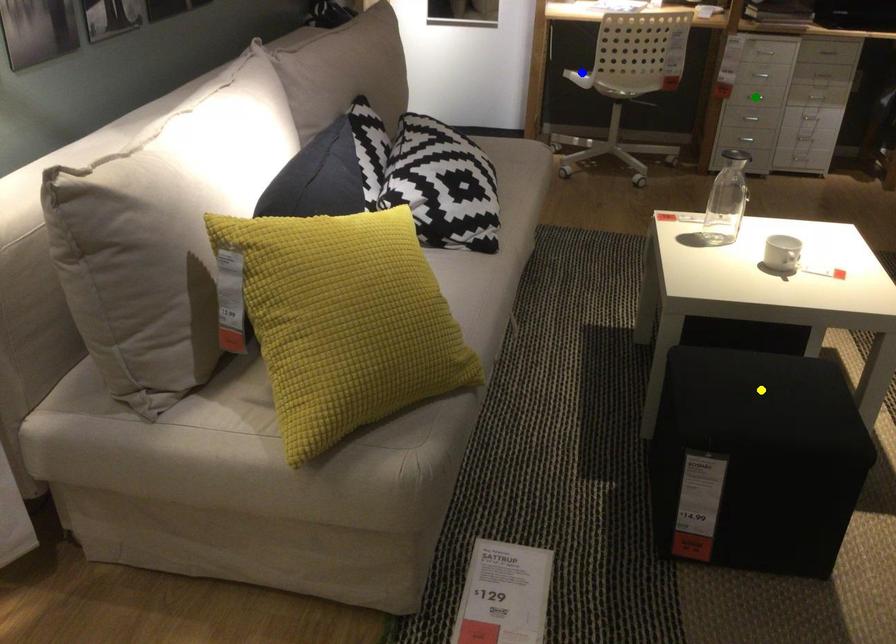
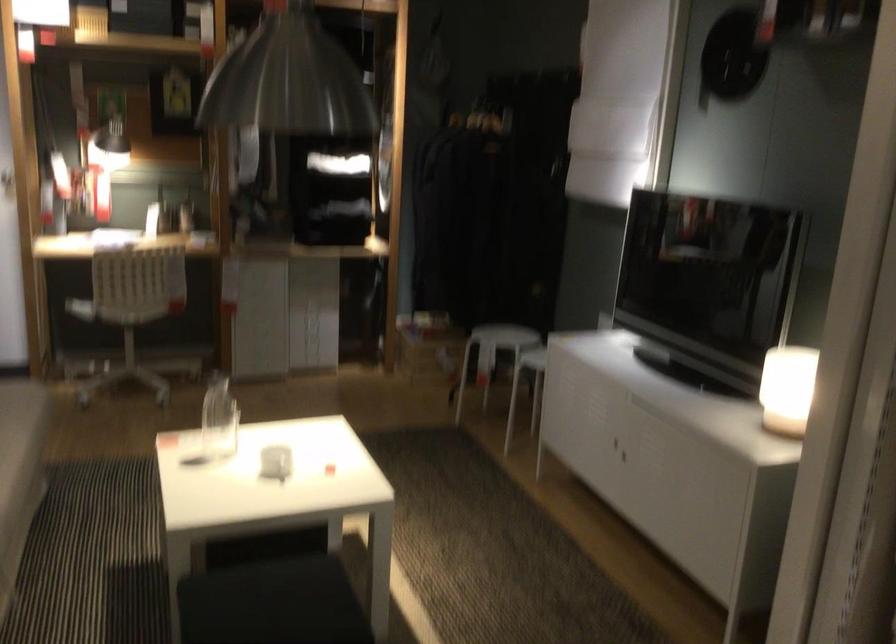
I am providing you with two images of the same scene from different viewpoints. Three points are marked in image1. Which point corresponds to a part or object that is occluded in image2?In image1, three points are marked. Which of them correspond to a part or object that is occluded in image2?Among the three points shown in image1, which one corresponds to a part or object that is no longer visible due to occlusion in image2?

Invisible in image2: green point.